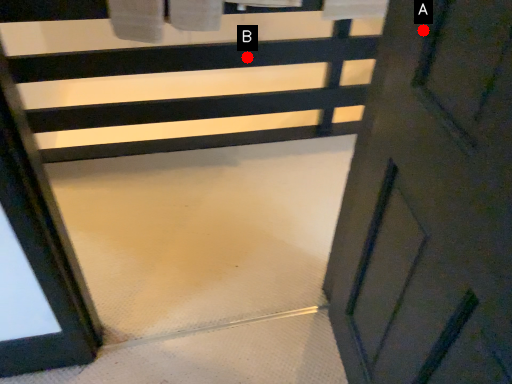
Question: Two points are circled on the image, labeled by A and B beside each circle. Which point is closer to the camera?

Choices:
 (A) A is closer
 (B) B is closer

Answer: (A)